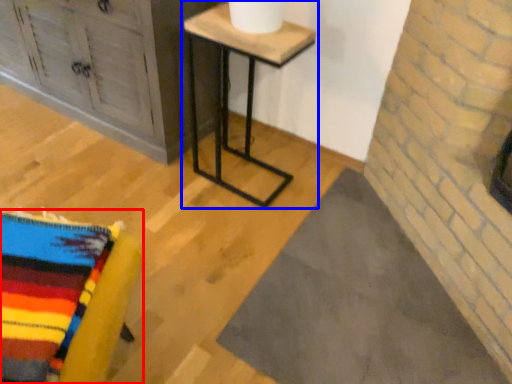
Question: Which point is further to the camera, furniture (highlighted by a red box) or table (highlighted by a blue box)?

Choices:
 (A) furniture
 (B) table

Answer: (B)